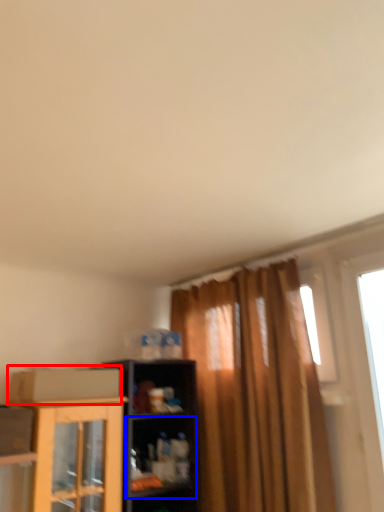
Question: Which object is closer to the camera taking this photo, cardboard box (highlighted by a red box) or shelf (highlighted by a blue box)?

Choices:
 (A) cardboard box
 (B) shelf

Answer: (A)